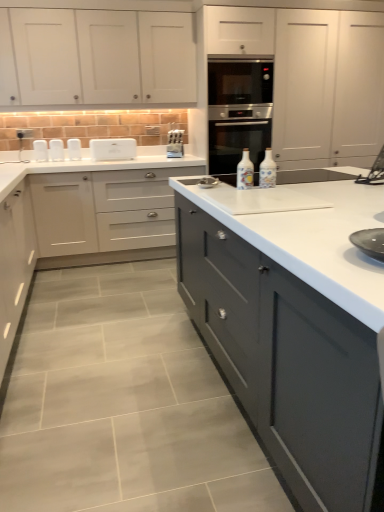
Question: Does matte white cabinets at center, the 1th cabinetry in the bottom-to-top sequence, have a lesser height compared to white plastic toaster at upper left, marked as the first appliance in a left-to-right arrangement?

Choices:
 (A) yes
 (B) no

Answer: (B)

Question: From a real-world perspective, is matte white cabinets at center, the 4th cabinetry in the top-to-bottom sequence, on white plastic toaster at upper left, which is counted as the 4th appliance, starting from the right?

Choices:
 (A) no
 (B) yes

Answer: (A)

Question: Could white plastic toaster at upper left, marked as the first appliance in a left-to-right arrangement, be considered to be inside matte white cabinets at center, the 1th cabinetry in the bottom-to-top sequence?

Choices:
 (A) yes
 (B) no

Answer: (B)

Question: Is matte white cabinets at center, the 4th cabinetry in the top-to-bottom sequence, located outside white plastic toaster at upper left, which is counted as the 4th appliance, starting from the right?

Choices:
 (A) yes
 (B) no

Answer: (A)

Question: Is the surface of matte white cabinets at center, the 4th cabinetry in the top-to-bottom sequence, in direct contact with white plastic toaster at upper left, which is counted as the 4th appliance, starting from the right?

Choices:
 (A) yes
 (B) no

Answer: (B)

Question: Relative to white matte cabinet at center, acting as the 3th cabinetry starting from the top, is white plastic toaster at upper left, which is counted as the 4th appliance, starting from the right, in front or behind?

Choices:
 (A) behind
 (B) front

Answer: (A)

Question: Considering the positions of white plastic toaster at upper left, which is counted as the 4th appliance, starting from the right, and white matte cabinet at center, acting as the 3th cabinetry starting from the top, in the image, is white plastic toaster at upper left, which is counted as the 4th appliance, starting from the right, taller or shorter than white matte cabinet at center, acting as the 3th cabinetry starting from the top,?

Choices:
 (A) tall
 (B) short

Answer: (B)

Question: Is point (51, 159) closer or farther from the camera than point (125, 174)?

Choices:
 (A) farther
 (B) closer

Answer: (B)

Question: Which is correct: white plastic toaster at upper left, which is counted as the 4th appliance, starting from the right, is inside white matte cabinet at center, acting as the 3th cabinetry starting from the top, or outside of it?

Choices:
 (A) outside
 (B) inside

Answer: (A)

Question: Considering the positions of matte white cabinets at center, the 4th cabinetry in the top-to-bottom sequence, and white plastic toaster at upper left, marked as the first appliance in a left-to-right arrangement, in the image, is matte white cabinets at center, the 4th cabinetry in the top-to-bottom sequence, taller or shorter than white plastic toaster at upper left, marked as the first appliance in a left-to-right arrangement,?

Choices:
 (A) short
 (B) tall

Answer: (B)

Question: Is matte white cabinets at center, the 4th cabinetry in the top-to-bottom sequence, in front of or behind white plastic toaster at upper left, marked as the first appliance in a left-to-right arrangement, in the image?

Choices:
 (A) front
 (B) behind

Answer: (A)

Question: Is matte white cabinets at center, the 1th cabinetry in the bottom-to-top sequence, inside the boundaries of white plastic toaster at upper left, marked as the first appliance in a left-to-right arrangement, or outside?

Choices:
 (A) inside
 (B) outside

Answer: (B)

Question: From a real-world perspective, is matte white cabinets at center, the 1th cabinetry in the bottom-to-top sequence, above or below white plastic toaster at upper left, which is counted as the 4th appliance, starting from the right?

Choices:
 (A) above
 (B) below

Answer: (B)

Question: Is point (94, 143) positioned closer to the camera than point (162, 87)?

Choices:
 (A) closer
 (B) farther

Answer: (B)

Question: In terms of height, does white plastic toaster at upper center, the 3th appliance in the left-to-right sequence, look taller or shorter compared to white matte cabinet at upper left, which is counted as the first cabinetry, starting from the top?

Choices:
 (A) short
 (B) tall

Answer: (A)